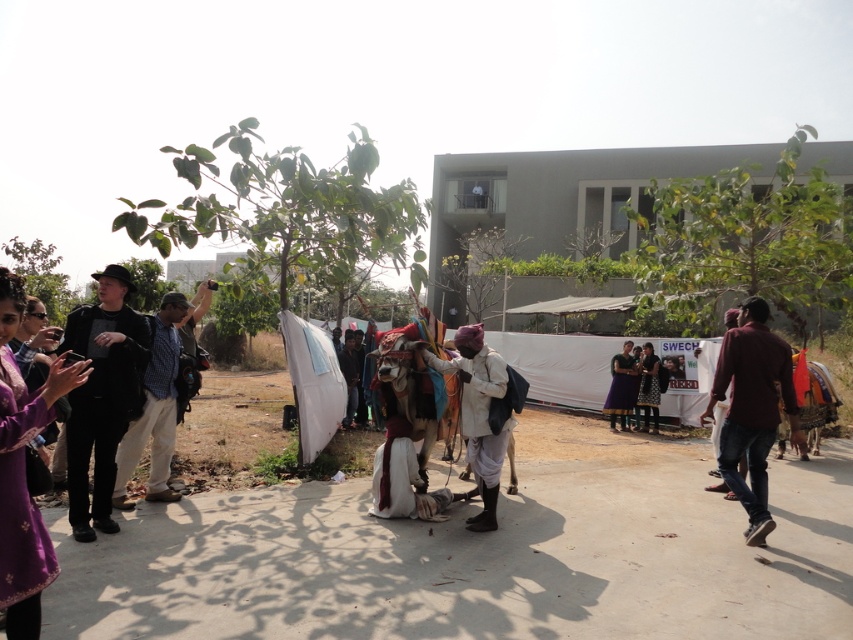
Question: Which point is closer to the camera?

Choices:
 (A) (4, 401)
 (B) (142, 384)
 (C) (717, 428)
 (D) (636, 371)

Answer: (A)

Question: Which of these objects is positioned farthest from the dark brown leather jacket at right?

Choices:
 (A) purple fabric dress at lower left
 (B) light brown cotton pants at left
 (C) dark purple fabric at center
 (D) white cotton turban at center

Answer: (A)

Question: Is purple fabric dress at lower left above dark brown leather jacket at right?

Choices:
 (A) no
 (B) yes

Answer: (B)

Question: Which point is closer to the camera?

Choices:
 (A) (171, 358)
 (B) (117, 410)
 (C) (727, 330)

Answer: (B)

Question: Can you confirm if dirt field at center is wider than dark purple dress at center?

Choices:
 (A) yes
 (B) no

Answer: (B)

Question: Is dirt field at center above white cotton turban at center?

Choices:
 (A) yes
 (B) no

Answer: (B)